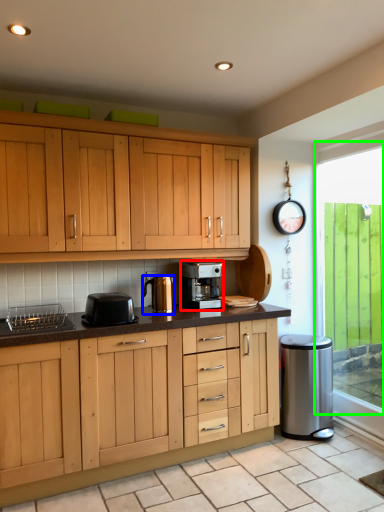
Question: Which object is positioned closest to home appliance (highlighted by a red box)? Select from kitchen appliance (highlighted by a blue box) and window (highlighted by a green box).

Choices:
 (A) kitchen appliance
 (B) window

Answer: (A)